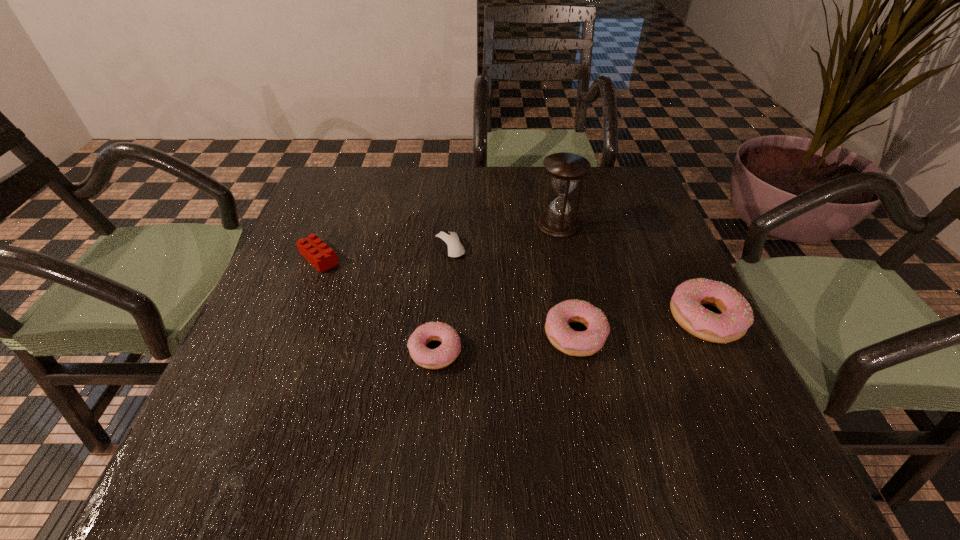
Locate an element on the screen. the shortest doughnut is located at coordinates (442, 356).

The image size is (960, 540). I want to click on the third tallest object, so click(575, 343).

Find the location of `the second tallest doughnut`. the second tallest doughnut is located at coordinates (575, 343).

Image resolution: width=960 pixels, height=540 pixels. I want to click on the rightmost doughnut, so click(686, 304).

Where is `the tallest doughnut`? the tallest doughnut is located at coordinates (686, 304).

The width and height of the screenshot is (960, 540). I want to click on hourglass, so click(565, 169).

Identify the location of mouse. This screenshot has width=960, height=540. (450, 242).

In order to click on the leftmost object in this screenshot , I will do 312,248.

Identify the location of free space located 0.160m on the back of the shortest doughnut. This screenshot has height=540, width=960. (442, 275).

The height and width of the screenshot is (540, 960). In order to click on vacant area located 0.140m on the right of the second doughnut from right to left in this screenshot , I will do `click(678, 334)`.